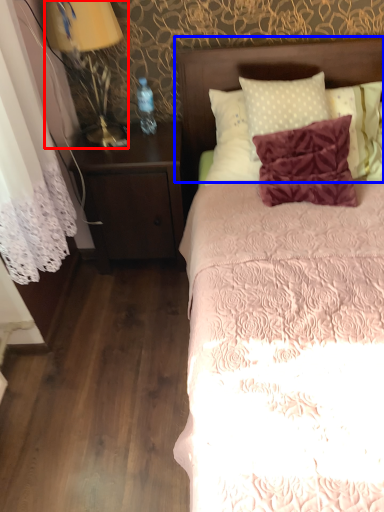
Question: Which object is further to the camera taking this photo, bedside lamp (highlighted by a red box) or headboard (highlighted by a blue box)?

Choices:
 (A) bedside lamp
 (B) headboard

Answer: (B)